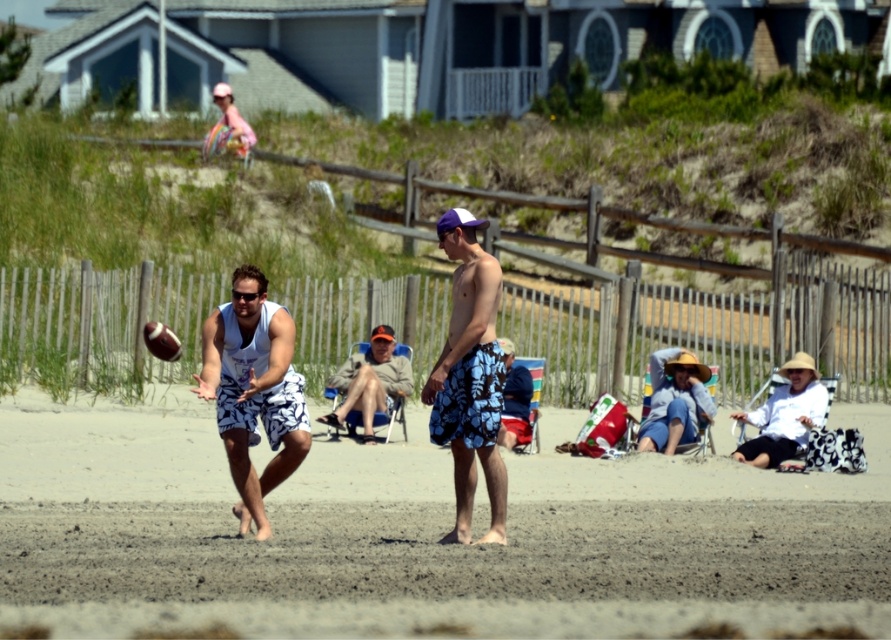
Between blue floral shorts at center and matte blue shorts at center, which one appears on the right side from the viewer's perspective?

From the viewer's perspective, matte blue shorts at center appears more on the right side.

Between blue floral shorts at center and matte blue shorts at center, which one has less height?

Standing shorter between the two is blue floral shorts at center.

Between point (503, 493) and point (503, 440), which one is positioned behind?

The point (503, 440) is behind.

This screenshot has height=640, width=891. Find the location of `blue floral shorts at center`. blue floral shorts at center is located at coordinates (469, 376).

Which of these two, brown sandy beach at center or khaki cotton shorts at center, stands taller?

khaki cotton shorts at center is taller.

Is brown sandy beach at center to the left of khaki cotton shorts at center from the viewer's perspective?

No, brown sandy beach at center is not to the left of khaki cotton shorts at center.

Between point (783, 508) and point (361, 410), which one is positioned behind?

Point (361, 410)

The width and height of the screenshot is (891, 640). Identify the location of brown sandy beach at center. (424, 534).

Who is positioned more to the right, blue floral shorts at center or khaki cotton shorts at center?

From the viewer's perspective, blue floral shorts at center appears more on the right side.

Does blue floral shorts at center have a greater height compared to khaki cotton shorts at center?

No, blue floral shorts at center is not taller than khaki cotton shorts at center.

Is point (469, 417) positioned before point (375, 403)?

Yes, it is in front of point (375, 403).

You are a GUI agent. You are given a task and a screenshot of the screen. Output one action in this format:
    pyautogui.click(x=<x>, y=<y>)
    Task: Click on the blue floral shorts at center
    
    Given the screenshot: What is the action you would take?
    pyautogui.click(x=469, y=376)